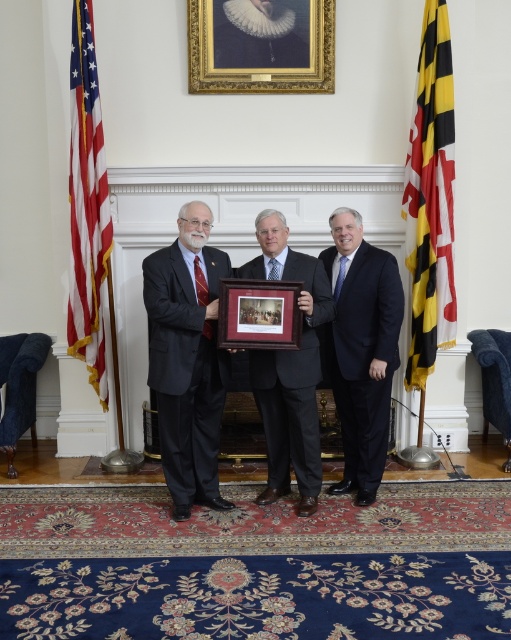
Question: Is matte black suit at center further to camera compared to american flag at left?

Choices:
 (A) yes
 (B) no

Answer: (B)

Question: Can you confirm if matte black suit at center is thinner than wooden polished picture frame at center?

Choices:
 (A) no
 (B) yes

Answer: (A)

Question: Is american flag at left bigger than white lace collar at upper center?

Choices:
 (A) no
 (B) yes

Answer: (B)

Question: Which of the following is the farthest from the observer?

Choices:
 (A) (254, 6)
 (B) (91, 316)

Answer: (A)

Question: Among these points, which one is nearest to the camera?

Choices:
 (A) (265, 301)
 (B) (362, 344)
 (C) (442, 157)

Answer: (A)

Question: Estimate the real-world distances between objects in this image. Which object is closer to the wooden polished picture frame at center?

Choices:
 (A) american flag at left
 (B) dark blue suit at center
 (C) yellow/black striped flag at right

Answer: (B)